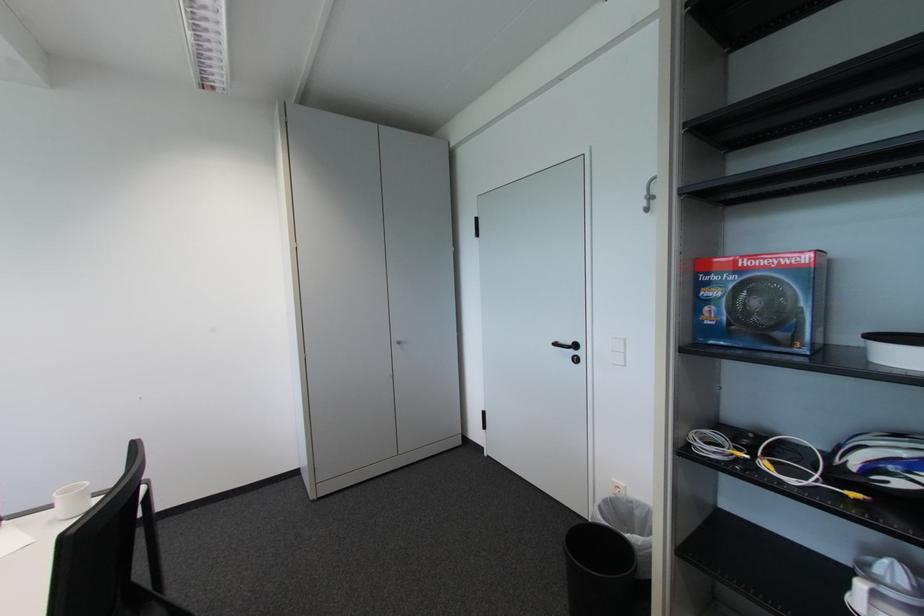
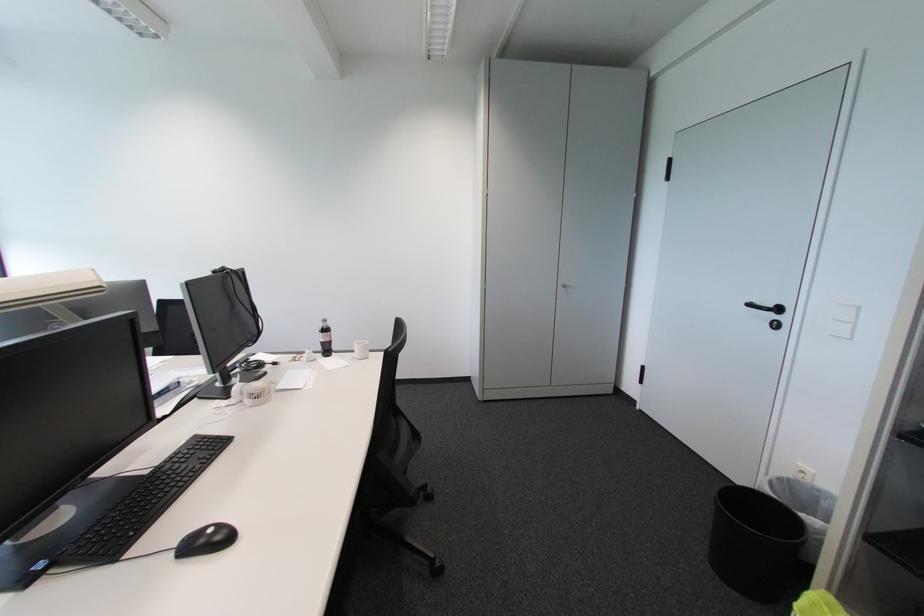
Question: The camera is either moving clockwise (left) or counter-clockwise (right) around the object. The first image is from the beginning of the video and the second image is from the end. Is the camera moving left or right when shooting the video?

Choices:
 (A) Left
 (B) Right

Answer: (B)